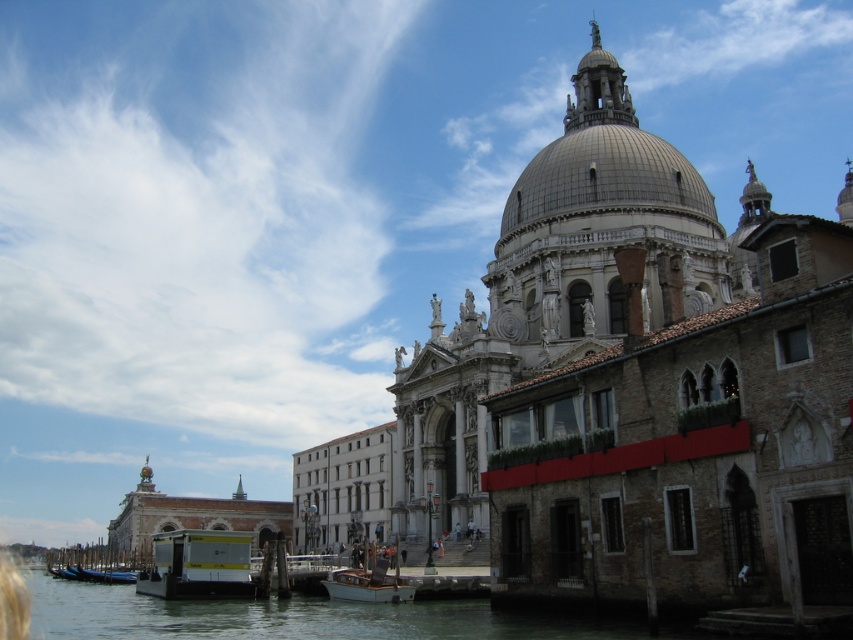
From the picture: You are standing on the bank of the canal and want to board the white glossy boat at lower left and the wooden polished boat at lower center. Which boat is closer to the bank where you are standing?

The white glossy boat at lower left is closer to the bank where you are standing because it is positioned below the wooden polished boat at lower center, indicating it is nearer to the observer.

Consider the image. You are an architect designing a new floating platform that needs to be placed between the clear water at lower left and the wooden polished boat at lower center. According to the scene, which object is taller, requiring the platform to be anchored higher to avoid touching it?

The clear water at lower left is much taller than the wooden polished boat at lower center, so the platform should be anchored higher to avoid touching the clear water at lower left.

You are a tourist planning to take a boat ride in Venice. You see the white glossy boat at lower left and the wooden polished boat at lower center. Which boat would you choose if you want to accommodate more passengers?

The white glossy boat at lower left has a larger size compared to the wooden polished boat at lower center, so it can accommodate more passengers.